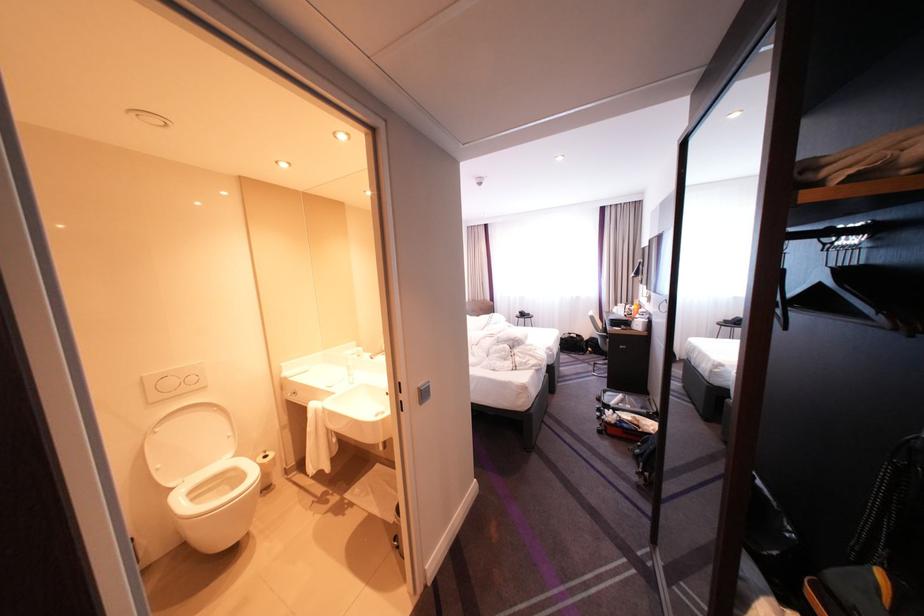
Image resolution: width=924 pixels, height=616 pixels. What are the coordinates of `black clothes hanger` in the screenshot? It's located at [857, 280].